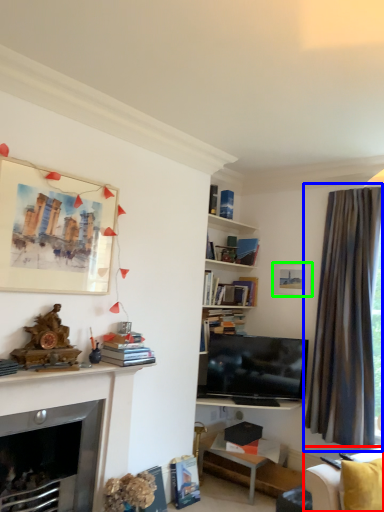
Question: Which object is positioned closest to studio couch (highlighted by a red box)? Select from curtain (highlighted by a blue box) and picture frame (highlighted by a green box).

Choices:
 (A) curtain
 (B) picture frame

Answer: (A)